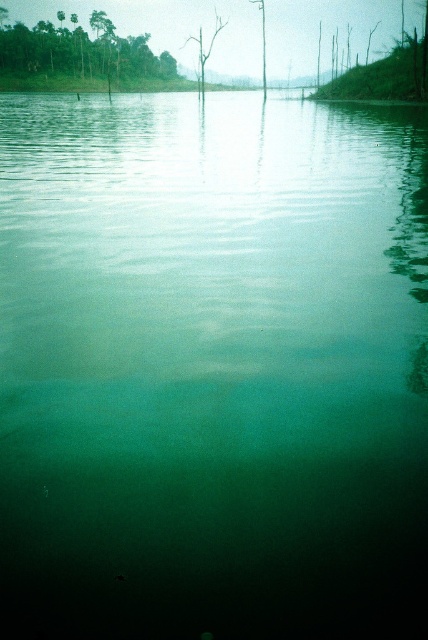
You are a bird that can fly at a constant speed of 2 meters per second. You are currently perched on the green leafy trees at upper left and want to reach the brown wood tree at center. How long will it take you to fly between them?

The green leafy trees at upper left and brown wood tree at center are 48.26 meters apart. Flying at 2 meters per second, it will take 24.13 seconds to cover the distance.

You are standing on the bank of the lake and see the green leafy trees at upper left and the brown wood tree at center. Which tree would cast a bigger shadow on the water surface?

The green leafy trees at upper left would cast a bigger shadow on the water surface because they are larger in size than the brown wood tree at center.